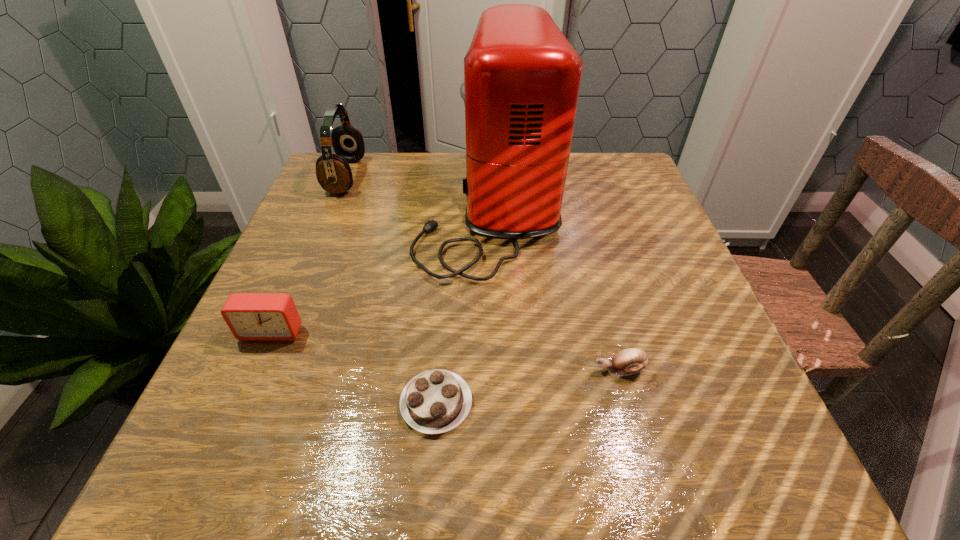
The image size is (960, 540). Find the location of `vacant space in between the escargot and the tallest object`. vacant space in between the escargot and the tallest object is located at coordinates (555, 289).

Identify the location of empty space between the alarm clock and the escargot. (445, 351).

Where is `free spot between the alarm clock and the escargot`? This screenshot has height=540, width=960. free spot between the alarm clock and the escargot is located at coordinates click(445, 351).

You are a GUI agent. You are given a task and a screenshot of the screen. Output one action in this format:
    pyautogui.click(x=<x>, y=<y>)
    Task: Click on the free space between the chocolate cake and the fourth shortest object
    This screenshot has width=960, height=540.
    Given the screenshot: What is the action you would take?
    pyautogui.click(x=391, y=290)

The height and width of the screenshot is (540, 960). Find the location of `vacant space that's between the alarm clock and the second tallest object`. vacant space that's between the alarm clock and the second tallest object is located at coordinates (309, 254).

Find the location of a particular element. empty location between the kitchen mixer and the second tallest object is located at coordinates (418, 192).

Locate which object is the second closest to the fourth shortest object. Please provide its 2D coordinates. Your answer should be formatted as a tuple, i.e. [(x, y)], where the tuple contains the x and y coordinates of a point satisfying the conditions above.

[(250, 316)]

You are a GUI agent. You are given a task and a screenshot of the screen. Output one action in this format:
    pyautogui.click(x=<x>, y=<y>)
    Task: Click on the object that is the nearest to the escargot
    The image size is (960, 540).
    Given the screenshot: What is the action you would take?
    pyautogui.click(x=522, y=77)

The width and height of the screenshot is (960, 540). I want to click on vacant position in the image that satisfies the following two spatial constraints: 1. on the front-facing side of the fourth tallest object; 2. on the front side of the shortest object, so click(628, 403).

In order to click on free point that satisfies the following two spatial constraints: 1. on the ear cups of the fourth shortest object; 2. on the right side of the chocolate cake in this screenshot , I will do `click(252, 403)`.